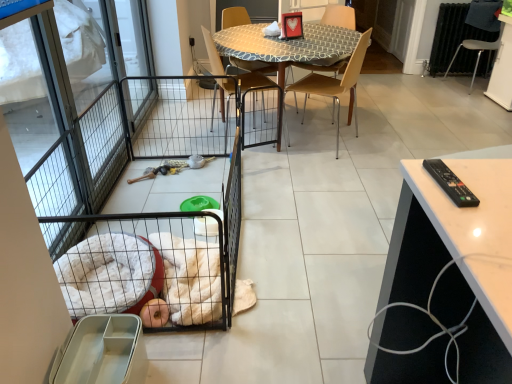
Question: Does wooden chair at center, positioned as the first chair in left-to-right order, have a greater height compared to patterned fabric table at center?

Choices:
 (A) no
 (B) yes

Answer: (B)

Question: From the image's perspective, does wooden chair at center, positioned as the first chair in left-to-right order, appear higher than patterned fabric table at center?

Choices:
 (A) yes
 (B) no

Answer: (B)

Question: Does wooden chair at center, which is the fourth chair in right-to-left order, have a lesser width compared to patterned fabric table at center?

Choices:
 (A) yes
 (B) no

Answer: (A)

Question: Is wooden chair at center, positioned as the first chair in left-to-right order, behind patterned fabric table at center?

Choices:
 (A) yes
 (B) no

Answer: (B)

Question: Is wooden chair at center, which is the fourth chair in right-to-left order, at the left side of patterned fabric table at center?

Choices:
 (A) yes
 (B) no

Answer: (A)

Question: From a real-world perspective, is metallic screen door at left physically located above or below metallic silver chair at right, the first chair when ordered from right to left?

Choices:
 (A) below
 (B) above

Answer: (B)

Question: Is metallic screen door at left in front of or behind metallic silver chair at right, the first chair when ordered from right to left, in the image?

Choices:
 (A) behind
 (B) front

Answer: (B)

Question: Do you think metallic screen door at left is within metallic silver chair at right, the first chair when ordered from right to left, or outside of it?

Choices:
 (A) inside
 (B) outside

Answer: (B)

Question: Considering the relative positions of metallic screen door at left and metallic silver chair at right, positioned as the 4th chair in left-to-right order, in the image provided, is metallic screen door at left to the left or to the right of metallic silver chair at right, positioned as the 4th chair in left-to-right order,?

Choices:
 (A) left
 (B) right

Answer: (A)

Question: Is light brown plastic chair at center, the 3th chair when ordered from right to left, taller or shorter than patterned fabric table at center?

Choices:
 (A) short
 (B) tall

Answer: (B)

Question: From a real-world perspective, is light brown plastic chair at center, which appears as the second chair when viewed from the left, above or below patterned fabric table at center?

Choices:
 (A) below
 (B) above

Answer: (B)

Question: Is light brown plastic chair at center, the 3th chair when ordered from right to left, situated inside patterned fabric table at center or outside?

Choices:
 (A) inside
 (B) outside

Answer: (A)

Question: From the image's perspective, is light brown plastic chair at center, the 3th chair when ordered from right to left, above or below patterned fabric table at center?

Choices:
 (A) above
 (B) below

Answer: (B)

Question: Is wooden chair at center, which is counted as the 3th chair, starting from the left, wider or thinner than black wire pet cage at left?

Choices:
 (A) thin
 (B) wide

Answer: (A)

Question: From the image's perspective, is wooden chair at center, the second chair viewed from the right, above or below black wire pet cage at left?

Choices:
 (A) above
 (B) below

Answer: (A)